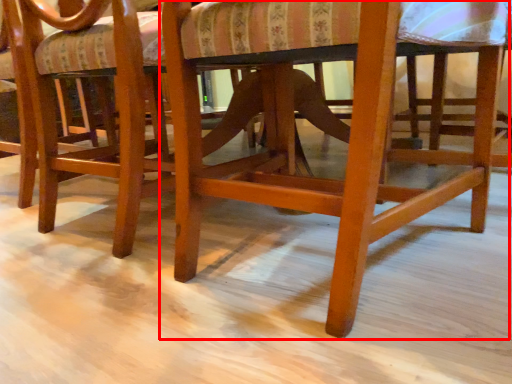
Question: In this image, where is chair (annotated by the red box) located relative to chair?

Choices:
 (A) right
 (B) left

Answer: (A)